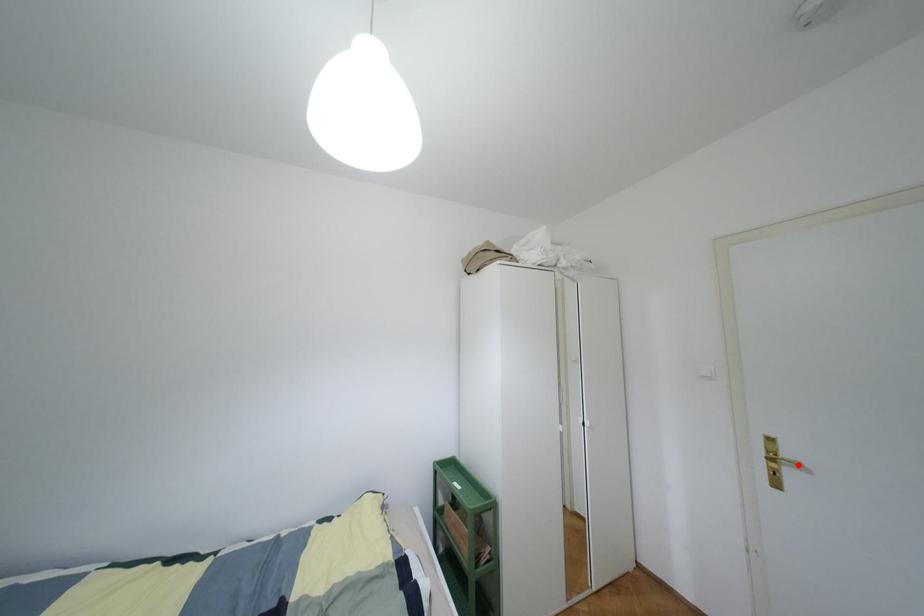
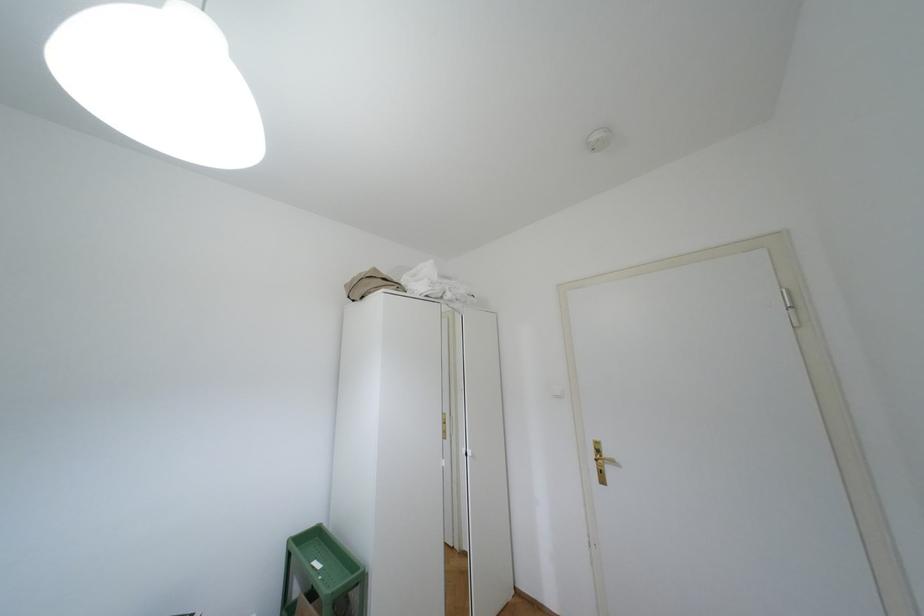
In the second image, find the point that corresponds to the highlighted location in the first image.

(612, 461)